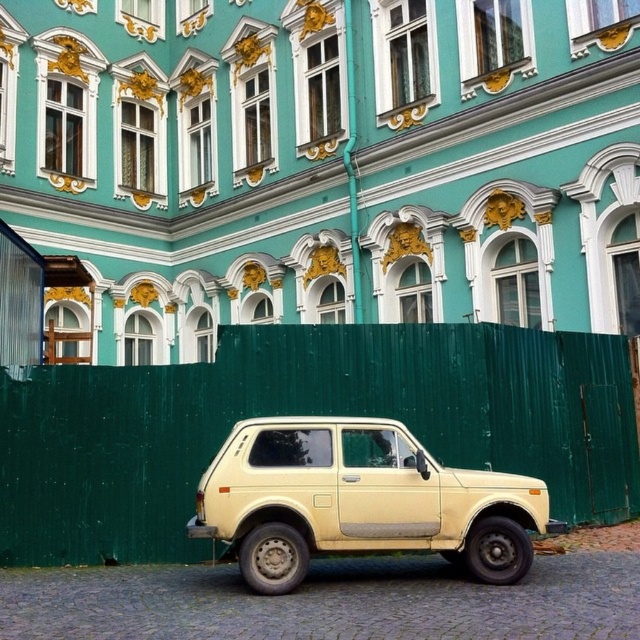
Question: Is green wooden fence at lower center to the right of beige matte suv at center from the viewer's perspective?

Choices:
 (A) yes
 (B) no

Answer: (B)

Question: Can you confirm if green wooden fence at lower center is thinner than beige matte suv at center?

Choices:
 (A) no
 (B) yes

Answer: (A)

Question: Is green wooden fence at lower center positioned before beige matte suv at center?

Choices:
 (A) no
 (B) yes

Answer: (A)

Question: Among these points, which one is nearest to the camera?

Choices:
 (A) (330, 476)
 (B) (586, 499)

Answer: (A)

Question: Among these objects, which one is farthest from the camera?

Choices:
 (A) green wooden fence at lower center
 (B) beige matte suv at center

Answer: (A)